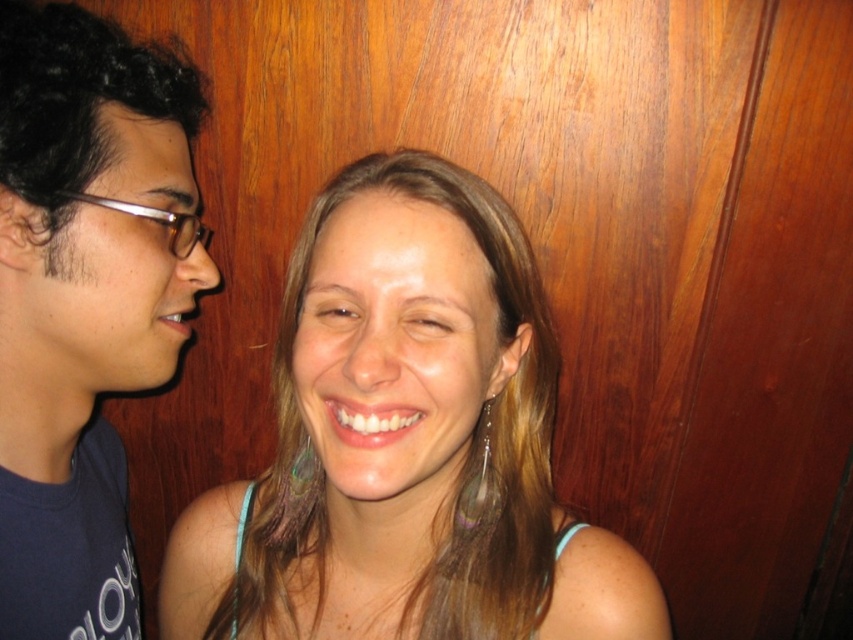
Question: Which point is farther to the camera?

Choices:
 (A) dark blue t-shirt at left
 (B) matte skin face at center

Answer: (A)

Question: Which point is closer to the camera?

Choices:
 (A) matte skin face at center
 (B) dark blue t-shirt at left

Answer: (A)

Question: Is matte skin face at center positioned at the back of dark blue t-shirt at left?

Choices:
 (A) yes
 (B) no

Answer: (B)

Question: Can you confirm if matte skin face at center is positioned to the left of dark blue t-shirt at left?

Choices:
 (A) no
 (B) yes

Answer: (A)

Question: Does matte skin face at center have a greater width compared to dark blue t-shirt at left?

Choices:
 (A) no
 (B) yes

Answer: (B)